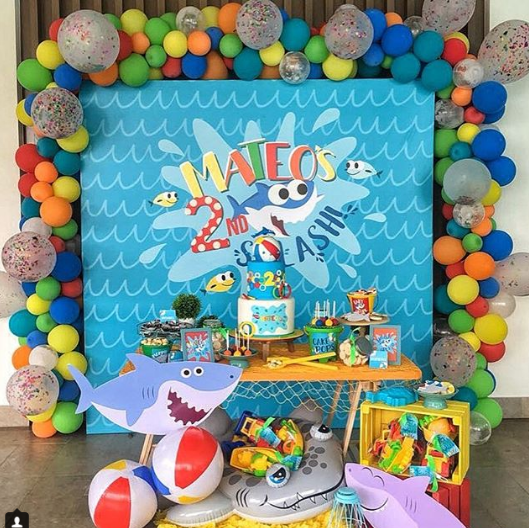
You are a GUI agent. You are given a task and a screenshot of the screen. Output one action in this format:
    pyautogui.click(x=<x>, y=<y>)
    Task: Click on the floor
    
    Given the screenshot: What is the action you would take?
    pyautogui.click(x=58, y=480)